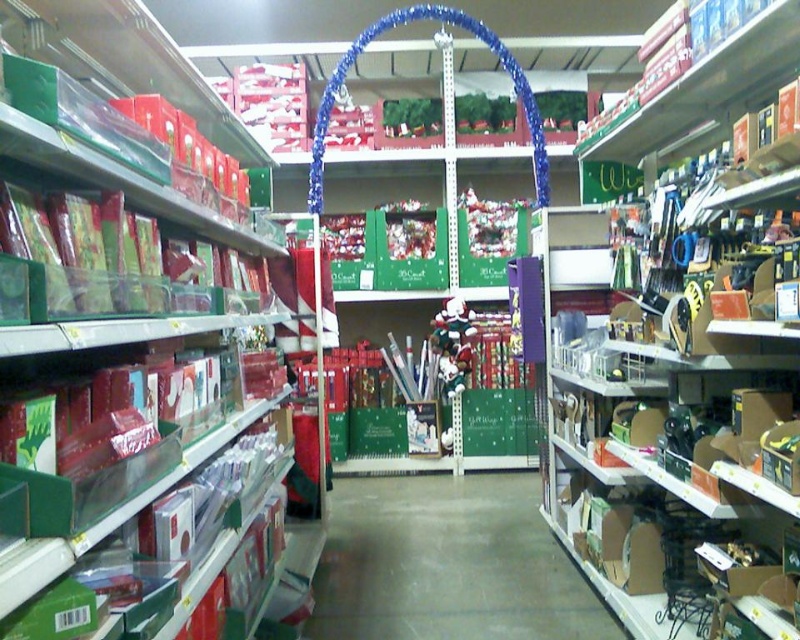
Question: Does cardboard boxes at right lie behind shiny metallic santa at center?

Choices:
 (A) no
 (B) yes

Answer: (A)

Question: Is cardboard boxes at right wider than concrete floor at center?

Choices:
 (A) no
 (B) yes

Answer: (A)

Question: Among these objects, which one is nearest to the camera?

Choices:
 (A) concrete floor at center
 (B) shiny metallic santa at center
 (C) matte red gift wrap at left
 (D) cardboard boxes at right

Answer: (C)

Question: In this image, where is cardboard boxes at right located relative to concrete floor at center?

Choices:
 (A) below
 (B) above

Answer: (B)

Question: Among these objects, which one is farthest from the camera?

Choices:
 (A) shiny metallic santa at center
 (B) matte red gift wrap at left
 (C) cardboard boxes at right
 (D) concrete floor at center

Answer: (A)

Question: Which of these objects is positioned closest to the concrete floor at center?

Choices:
 (A) cardboard boxes at right
 (B) shiny metallic santa at center
 (C) matte red gift wrap at left

Answer: (A)